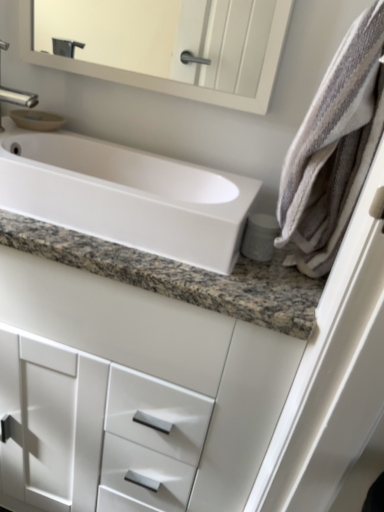
Question: Considering the positions of point (342, 106) and point (150, 240), is point (342, 106) closer or farther from the camera than point (150, 240)?

Choices:
 (A) closer
 (B) farther

Answer: (A)

Question: From the image's perspective, is striped cotton bath towel at right positioned above or below white glossy sink at center?

Choices:
 (A) above
 (B) below

Answer: (A)

Question: Estimate the real-world distances between objects in this image. Which object is farther from the white glossy sink at center?

Choices:
 (A) striped cotton bath towel at right
 (B) silver metallic faucet at upper left
 (C) white glossy cabinet at center

Answer: (B)

Question: Based on their relative distances, which object is farther from the striped cotton bath towel at right?

Choices:
 (A) white glossy cabinet at center
 (B) silver metallic faucet at upper left
 (C) white glossy sink at center

Answer: (B)